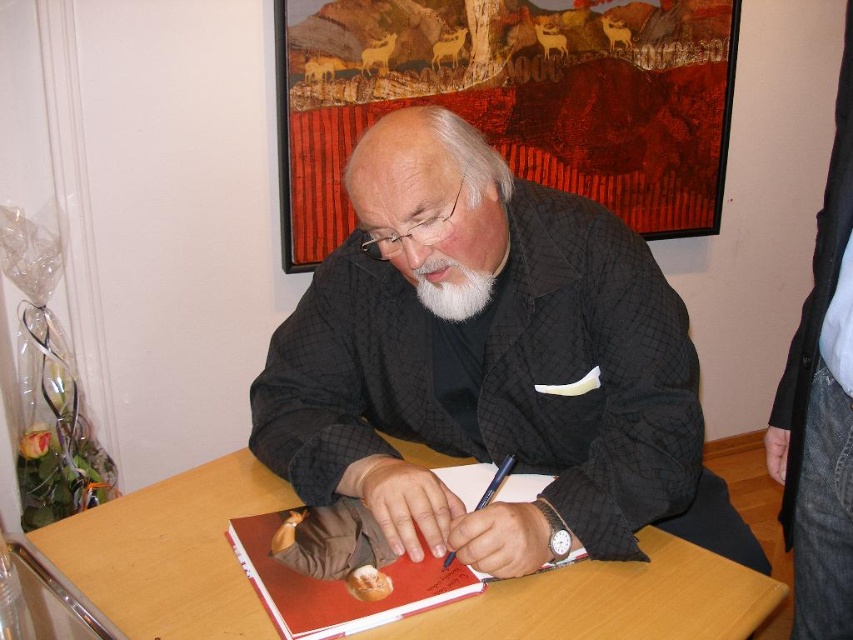
Question: Which point is closer to the camera?

Choices:
 (A) white fuzzy beard at center
 (B) blue metallic pen at center

Answer: (B)

Question: Among these objects, which one is nearest to the camera?

Choices:
 (A) black textured jacket at center
 (B) white fuzzy beard at center
 (C) red matte notebook at center

Answer: (C)

Question: Which point is farther to the camera?

Choices:
 (A) (252, 582)
 (B) (396, 204)

Answer: (B)

Question: Is wooden table at center below blue metallic pen at center?

Choices:
 (A) no
 (B) yes

Answer: (B)

Question: Considering the relative positions of black textured jacket at center and wooden table at center in the image provided, where is black textured jacket at center located with respect to wooden table at center?

Choices:
 (A) right
 (B) left

Answer: (A)

Question: Is wooden table at center wider than white fuzzy beard at center?

Choices:
 (A) no
 (B) yes

Answer: (B)